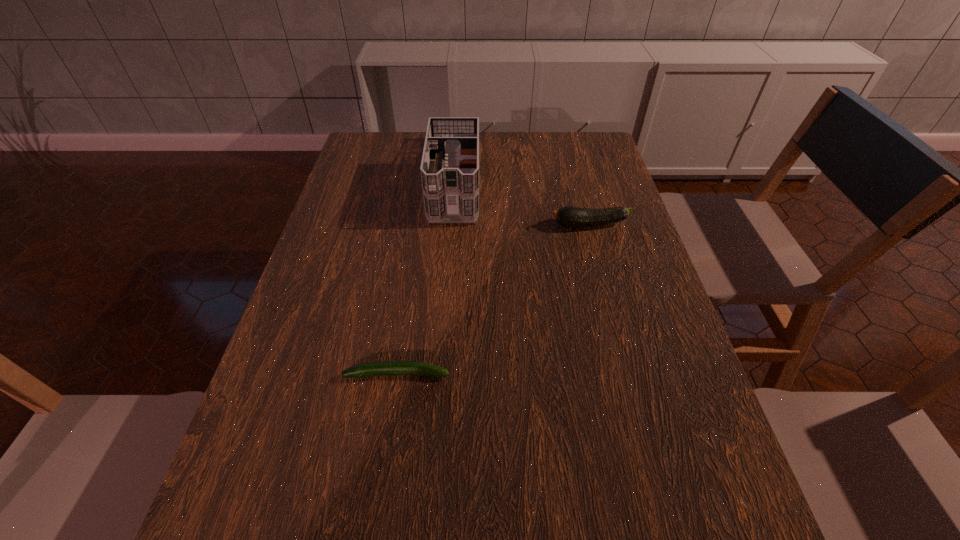
This screenshot has height=540, width=960. I want to click on object that is at the far edge, so click(x=449, y=168).

The height and width of the screenshot is (540, 960). I want to click on object positioned at the left edge, so click(388, 368).

The width and height of the screenshot is (960, 540). In order to click on object that is positioned at the right edge in this screenshot , I will do `click(568, 216)`.

Image resolution: width=960 pixels, height=540 pixels. In order to click on free spot at the far edge of the desktop in this screenshot , I will do `click(523, 167)`.

Where is `free space at the left edge of the desktop`? This screenshot has height=540, width=960. free space at the left edge of the desktop is located at coordinates pyautogui.click(x=310, y=375).

You are a GUI agent. You are given a task and a screenshot of the screen. Output one action in this format:
    pyautogui.click(x=<x>, y=<y>)
    Task: Click on the free space at the right edge of the desktop
    Image resolution: width=960 pixels, height=540 pixels.
    Given the screenshot: What is the action you would take?
    pyautogui.click(x=626, y=281)

Where is `vacant space at the far left corner`? vacant space at the far left corner is located at coordinates (378, 137).

Where is `vacant space at the far right corner of the desktop`? vacant space at the far right corner of the desktop is located at coordinates (574, 149).

Where is `vacant area that lies between the dollhouse and the taller zucchini`? This screenshot has width=960, height=540. vacant area that lies between the dollhouse and the taller zucchini is located at coordinates (522, 201).

The height and width of the screenshot is (540, 960). Find the location of `free space between the second shortest object and the nearer zucchini`. free space between the second shortest object and the nearer zucchini is located at coordinates (493, 300).